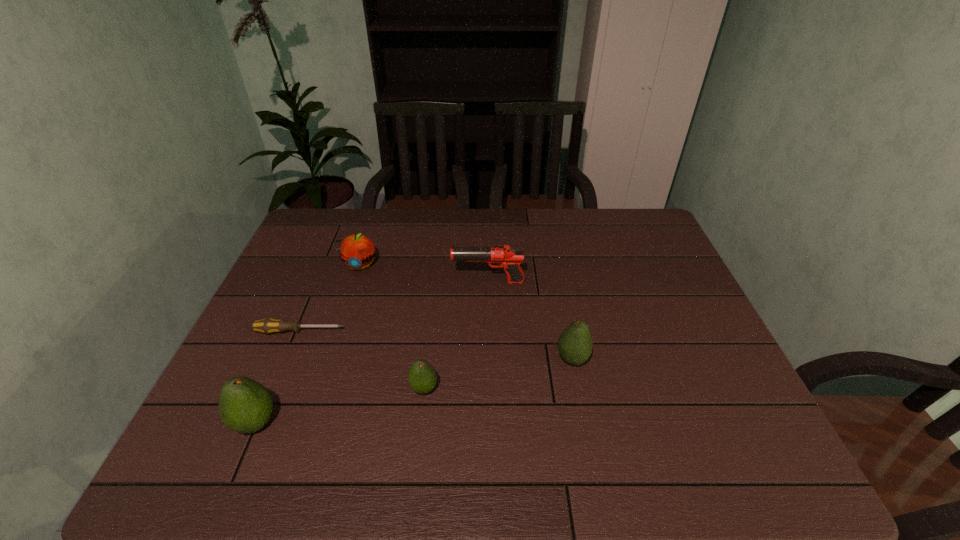
This screenshot has height=540, width=960. Find the location of `avocado that can be found as the third closest to the apple`. avocado that can be found as the third closest to the apple is located at coordinates (575, 344).

Identify which avocado is located as the second nearest to the leftmost avocado. Please provide its 2D coordinates. Your answer should be formatted as a tuple, i.e. [(x, y)], where the tuple contains the x and y coordinates of a point satisfying the conditions above.

[(575, 344)]

Where is `free space in the image that satisfies the following two spatial constraints: 1. at the aiming end of the fifth nearest object; 2. on the right side of the rightmost avocado`? free space in the image that satisfies the following two spatial constraints: 1. at the aiming end of the fifth nearest object; 2. on the right side of the rightmost avocado is located at coordinates (490, 359).

Find the location of a particular element. vacant point that satisfies the following two spatial constraints: 1. at the tip of the fifth tallest object; 2. on the right side of the screwdriver is located at coordinates (276, 389).

Find the location of a particular element. Image resolution: width=960 pixels, height=540 pixels. free space that satisfies the following two spatial constraints: 1. on the back side of the nearest object; 2. on the left side of the farthest object is located at coordinates (323, 265).